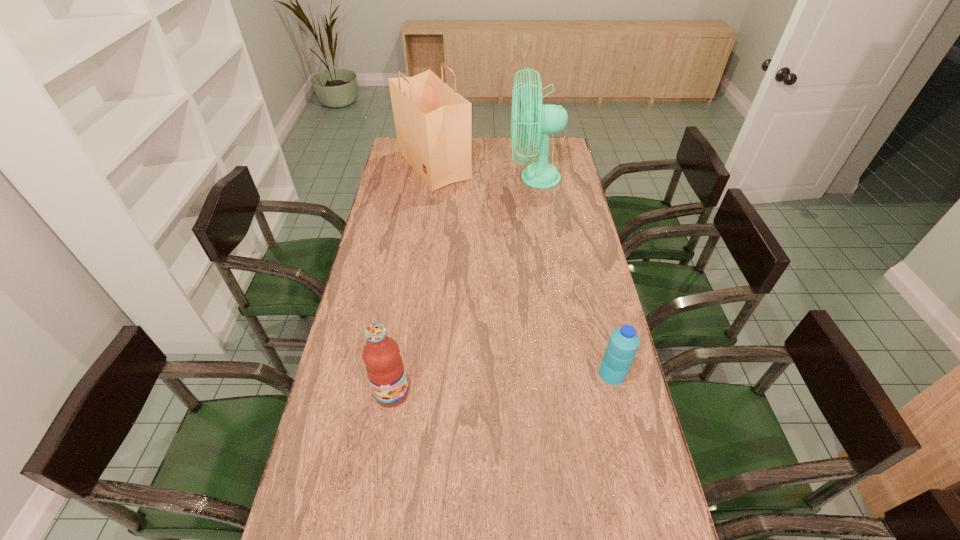
Where is `free region at the right edge of the desktop`? The width and height of the screenshot is (960, 540). free region at the right edge of the desktop is located at coordinates (551, 247).

Where is `blank space at the far left corner`? The width and height of the screenshot is (960, 540). blank space at the far left corner is located at coordinates (396, 147).

Identify the location of free space between the shortest object and the third tallest object. This screenshot has height=540, width=960. (502, 383).

At what (x,y) coordinates should I click in order to perform the action: click on free point between the fan and the grocery bag. Please return your answer as a coordinate pair (x, y). Image resolution: width=960 pixels, height=540 pixels. Looking at the image, I should click on (484, 172).

I want to click on empty space that is in between the water bottle and the fan, so click(573, 276).

At what (x,y) coordinates should I click in order to perform the action: click on free spot between the shortest object and the fan. Please return your answer as a coordinate pair (x, y). Image resolution: width=960 pixels, height=540 pixels. Looking at the image, I should click on (573, 276).

Where is `free space that is in between the fan and the grocery bag`? The image size is (960, 540). free space that is in between the fan and the grocery bag is located at coordinates (484, 172).

In order to click on empty space that is in between the shortest object and the grocery bag in this screenshot , I will do `click(523, 269)`.

You are a GUI agent. You are given a task and a screenshot of the screen. Output one action in this format:
    pyautogui.click(x=<x>, y=<y>)
    Task: Click on the free space between the shortest object and the fan
    The image size is (960, 540).
    Given the screenshot: What is the action you would take?
    pyautogui.click(x=573, y=276)

Find the location of a particular element. unoccupied position between the grocery bag and the water bottle is located at coordinates (523, 269).